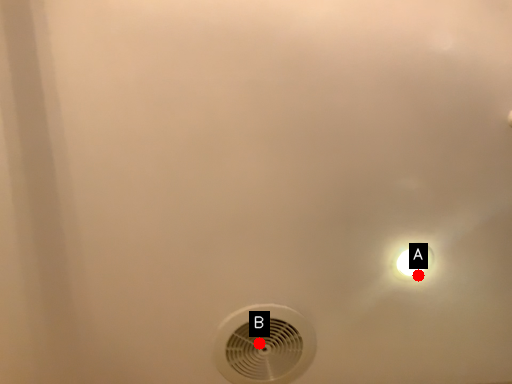
Question: Two points are circled on the image, labeled by A and B beside each circle. Which point appears closest to the camera in this image?

Choices:
 (A) A is closer
 (B) B is closer

Answer: (A)